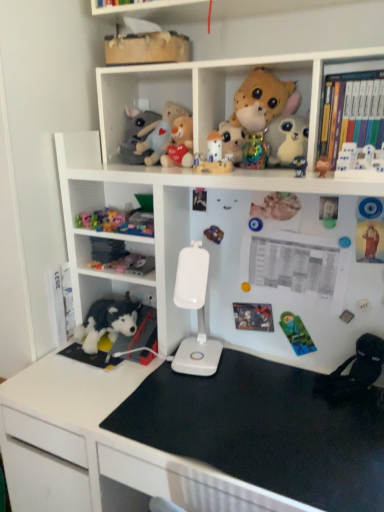
The height and width of the screenshot is (512, 384). Identify the location of vacant area in front of white plastic lamp at center. (198, 403).